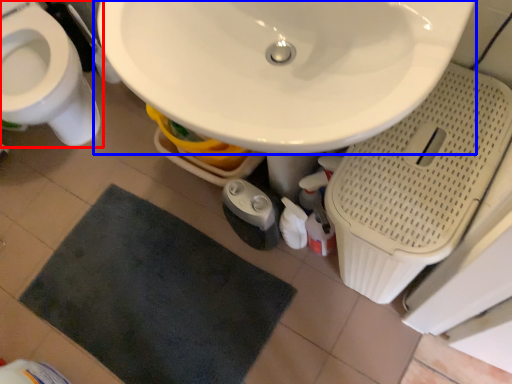
Question: Which object is closer to the camera taking this photo, toilet (highlighted by a red box) or sink (highlighted by a blue box)?

Choices:
 (A) toilet
 (B) sink

Answer: (B)